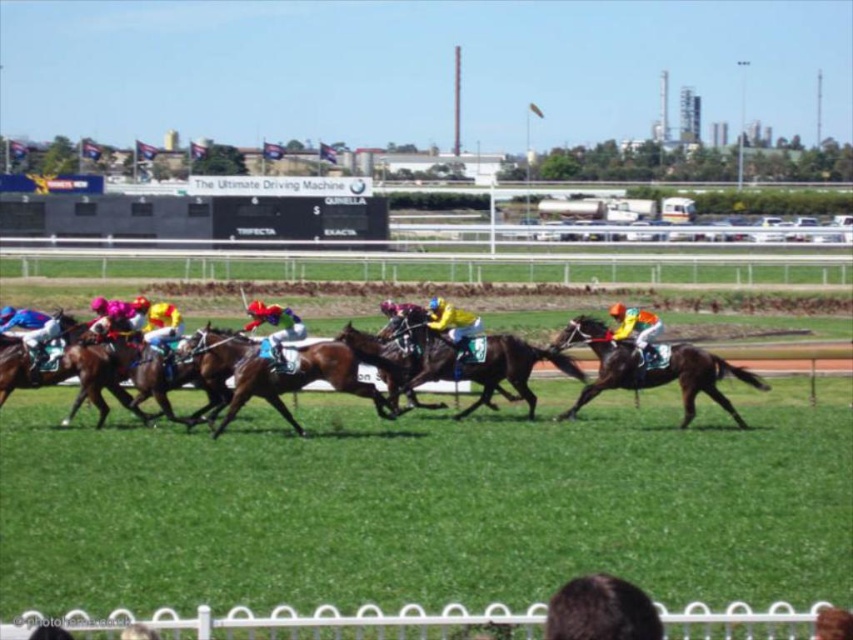
Does black glossy horse at center have a smaller size compared to yellow matte helmet at center?

Yes.

Is black glossy horse at center shorter than yellow matte helmet at center?

Incorrect, black glossy horse at center's height does not fall short of yellow matte helmet at center's.

Is point (714, 378) farther from viewer compared to point (630, 316)?

No, (714, 378) is in front of (630, 316).

Where is `black glossy horse at center`? black glossy horse at center is located at coordinates (651, 369).

Does brown glossy horse at center appear on the left side of black glossy horse at center?

No, brown glossy horse at center is not to the left of black glossy horse at center.

Is brown glossy horse at center closer to camera compared to black glossy horse at center?

No, brown glossy horse at center is further to the viewer.

Between point (387, 380) and point (646, 358), which one is positioned in front?

Point (646, 358)

The height and width of the screenshot is (640, 853). What are the coordinates of `brown glossy horse at center` in the screenshot? It's located at (636, 368).

Does brown glossy horse at center appear under yellow fabric jockey at center?

Correct, brown glossy horse at center is located below yellow fabric jockey at center.

Is point (691, 348) positioned in front of point (434, 317)?

Yes.

Does point (693, 416) lie in front of point (479, 320)?

Yes, point (693, 416) is in front of point (479, 320).

At what (x,y) coordinates should I click in order to perform the action: click on brown glossy horse at center. Please return your answer as a coordinate pair (x, y). Looking at the image, I should click on (636, 368).